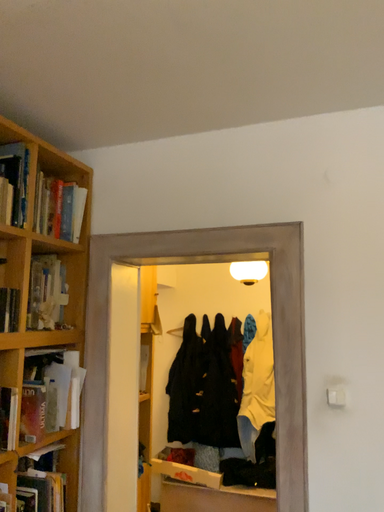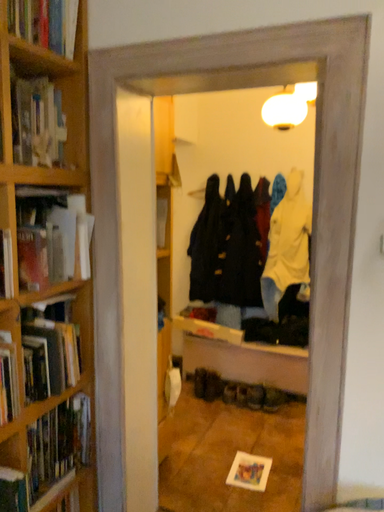
Question: How did the camera likely rotate when shooting the video?

Choices:
 (A) rotated upward
 (B) rotated downward

Answer: (B)